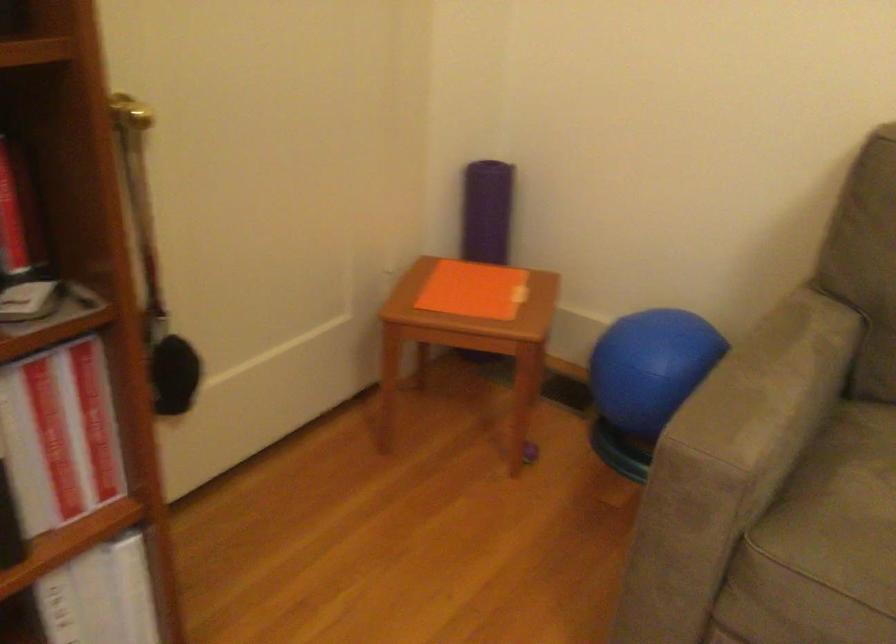
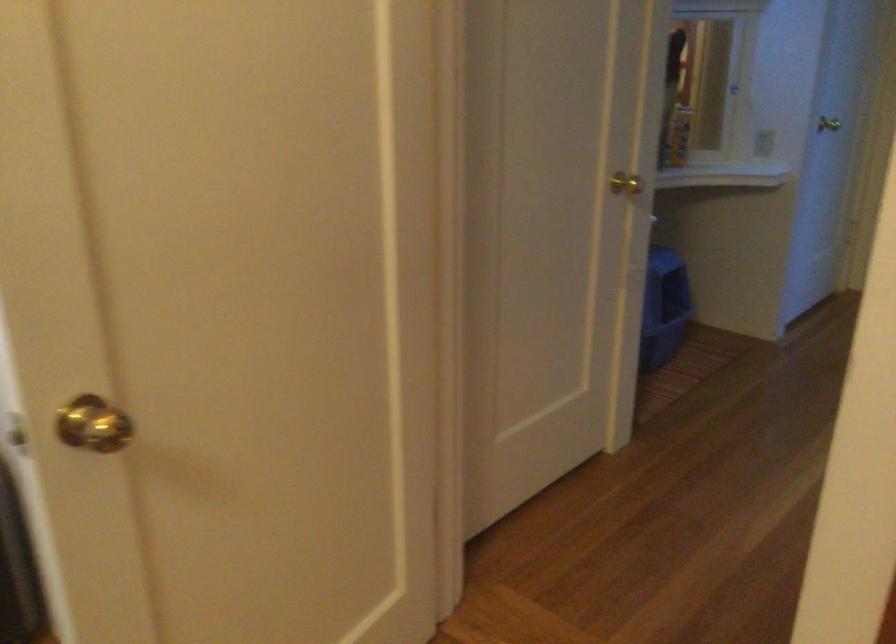
The images are taken continuously from a first-person perspective. In which direction is your viewpoint rotating?

The camera's rotation is toward left-down.